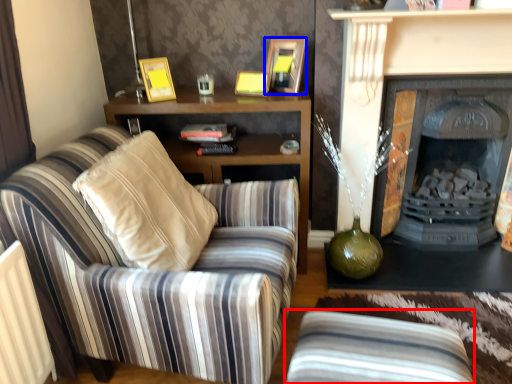
Question: Which point is closer to the camera, studio couch (highlighted by a red box) or picture frame (highlighted by a blue box)?

Choices:
 (A) studio couch
 (B) picture frame

Answer: (A)